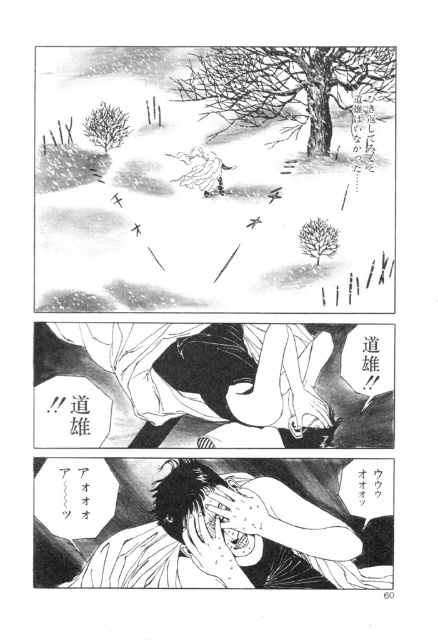
Based on the photo, can you confirm if white fluffy snow at center is positioned above white paper at lower center?

Indeed, white fluffy snow at center is positioned over white paper at lower center.

Is the position of white fluffy snow at center more distant than that of white paper at lower center?

Result: No, it is not.

Find the location of `white fluffy snow at center`. white fluffy snow at center is located at coordinates (215, 179).

Can you confirm if smooth black hair at center is wider than white paper at lower center?

Yes.

What do you see at coordinates (237, 381) in the screenshot?
I see `smooth black hair at center` at bounding box center [237, 381].

The width and height of the screenshot is (438, 640). In order to click on smooth black hair at center in this screenshot , I will do `click(237, 381)`.

Is point (56, 163) positioned after point (218, 438)?

No.

Can you confirm if white fluffy snow at center is smaller than smooth black hair at center?

No, white fluffy snow at center is not smaller than smooth black hair at center.

Is point (392, 211) farther from camera compared to point (162, 397)?

That is False.

Locate an element on the screen. The image size is (438, 640). white fluffy snow at center is located at coordinates (215, 179).